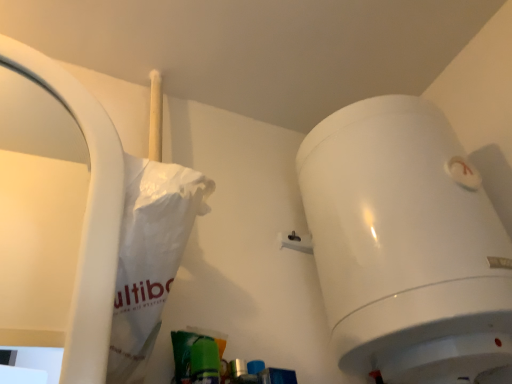
The height and width of the screenshot is (384, 512). Describe the element at coordinates (150, 256) in the screenshot. I see `white paper bag at left` at that location.

I want to click on white paper bag at left, so click(x=150, y=256).

Consider the image. Measure the distance between white paper bag at left and camera.

white paper bag at left is 18.62 inches away from camera.

I want to click on white glossy toilet at upper right, so click(406, 244).

What do you see at coordinates (406, 244) in the screenshot? The image size is (512, 384). I see `white glossy toilet at upper right` at bounding box center [406, 244].

Where is `white paper bag at left`? This screenshot has height=384, width=512. white paper bag at left is located at coordinates (150, 256).

Can you confirm if white glossy toilet at upper right is positioned to the right of white paper bag at left?

Yes.

In the scene shown: Is white glossy toilet at upper right positioned behind white paper bag at left?

Yes, white glossy toilet at upper right is further from the camera.

Which is further, (351,191) or (141,258)?

The point (351,191) is farther from the camera.

From the image's perspective, does white glossy toilet at upper right appear lower than white paper bag at left?

Indeed, from the image's perspective, white glossy toilet at upper right is shown beneath white paper bag at left.

From a real-world perspective, is white glossy toilet at upper right positioned under white paper bag at left based on gravity?

No, from a real-world perspective, white glossy toilet at upper right is not beneath white paper bag at left.

Looking at their sizes, would you say white glossy toilet at upper right is wider or thinner than white paper bag at left?

Considering their sizes, white glossy toilet at upper right looks broader than white paper bag at left.

Can you confirm if white glossy toilet at upper right is shorter than white paper bag at left?

No, white glossy toilet at upper right is not shorter than white paper bag at left.

Is white glossy toilet at upper right smaller than white paper bag at left?

No.

Would you say white glossy toilet at upper right is inside or outside white paper bag at left?

white glossy toilet at upper right is outside white paper bag at left.

Is white glossy toilet at upper right not close to white paper bag at left?

Actually, white glossy toilet at upper right and white paper bag at left are a little close together.

Could you tell me if white glossy toilet at upper right is turned towards white paper bag at left?

No, white glossy toilet at upper right is not facing towards white paper bag at left.

Measure the distance between white glossy toilet at upper right and white paper bag at left.

13.81 inches.

At what (x,y) coordinates should I click in order to perform the action: click on paper bag that is under the white glossy toilet at upper right (from a real-world perspective). Please return your answer as a coordinate pair (x, y). The width and height of the screenshot is (512, 384). Looking at the image, I should click on (150, 256).

Considering the positions of objects white paper bag at left and white glossy toilet at upper right in the image provided, who is more to the right, white paper bag at left or white glossy toilet at upper right?

white glossy toilet at upper right is more to the right.

Does white paper bag at left lie in front of white glossy toilet at upper right?

That is True.

Considering the positions of point (128, 289) and point (435, 312), is point (128, 289) closer or farther from the camera than point (435, 312)?

Clearly, point (128, 289) is closer to the camera than point (435, 312).

Consider the image. From the image's perspective, is white paper bag at left on top of white glossy toilet at upper right?

Correct, white paper bag at left appears higher than white glossy toilet at upper right in the image.

Looking at this image, from a real-world perspective, is white paper bag at left positioned over white glossy toilet at upper right based on gravity?

Actually, white paper bag at left is physically below white glossy toilet at upper right in the real world.

Does white paper bag at left have a lesser width compared to white glossy toilet at upper right?

Correct, the width of white paper bag at left is less than that of white glossy toilet at upper right.

Between white paper bag at left and white glossy toilet at upper right, which one has less height?

Standing shorter between the two is white paper bag at left.

Which of these two, white paper bag at left or white glossy toilet at upper right, is bigger?

white glossy toilet at upper right.

Could white glossy toilet at upper right be considered to be inside white paper bag at left?

No, white paper bag at left does not contain white glossy toilet at upper right.

Is white paper bag at left touching white glossy toilet at upper right?

No, white paper bag at left is not with white glossy toilet at upper right.

Does white paper bag at left turn towards white glossy toilet at upper right?

No, white paper bag at left is not turned towards white glossy toilet at upper right.

The image size is (512, 384). Identify the location of toilet on the right of white paper bag at left. (406, 244).

Find the location of a particular element. paper bag in front of the white glossy toilet at upper right is located at coordinates [x=150, y=256].

Where is `paper bag above the white glossy toilet at upper right (from the image's perspective)`? The height and width of the screenshot is (384, 512). paper bag above the white glossy toilet at upper right (from the image's perspective) is located at coordinates (x=150, y=256).